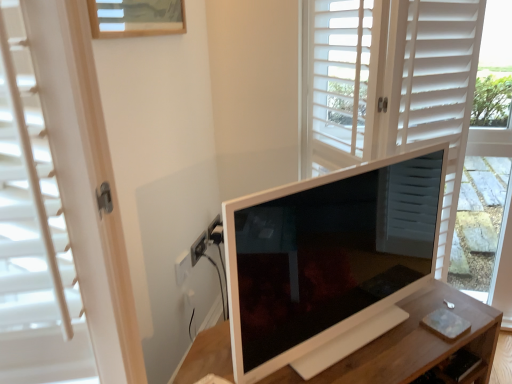
Question: From a real-world perspective, does white wooden table at center stand above wooden drawer at lower right?

Choices:
 (A) no
 (B) yes

Answer: (A)

Question: Can you confirm if white wooden table at center is bigger than wooden drawer at lower right?

Choices:
 (A) yes
 (B) no

Answer: (A)

Question: From the image's perspective, does white wooden table at center appear higher than wooden drawer at lower right?

Choices:
 (A) no
 (B) yes

Answer: (A)

Question: Can you confirm if white wooden table at center is taller than wooden drawer at lower right?

Choices:
 (A) yes
 (B) no

Answer: (A)

Question: Does white wooden table at center have a greater width compared to wooden drawer at lower right?

Choices:
 (A) no
 (B) yes

Answer: (B)

Question: Considering the relative positions of white wooden table at center and wooden drawer at lower right in the image provided, is white wooden table at center behind wooden drawer at lower right?

Choices:
 (A) yes
 (B) no

Answer: (B)

Question: Is white wooden table at center not close to white glossy monitor at center?

Choices:
 (A) yes
 (B) no

Answer: (B)

Question: From a real-world perspective, is white wooden table at center located beneath white glossy monitor at center?

Choices:
 (A) yes
 (B) no

Answer: (A)

Question: Does white wooden table at center appear on the right side of white glossy monitor at center?

Choices:
 (A) no
 (B) yes

Answer: (A)

Question: Can you confirm if white wooden table at center is wider than white glossy monitor at center?

Choices:
 (A) yes
 (B) no

Answer: (A)

Question: Is white wooden table at center oriented away from white glossy monitor at center?

Choices:
 (A) no
 (B) yes

Answer: (A)

Question: From the image's perspective, is white wooden table at center below white glossy monitor at center?

Choices:
 (A) no
 (B) yes

Answer: (B)

Question: From a real-world perspective, is wooden drawer at lower right on white wooden table at center?

Choices:
 (A) no
 (B) yes

Answer: (B)